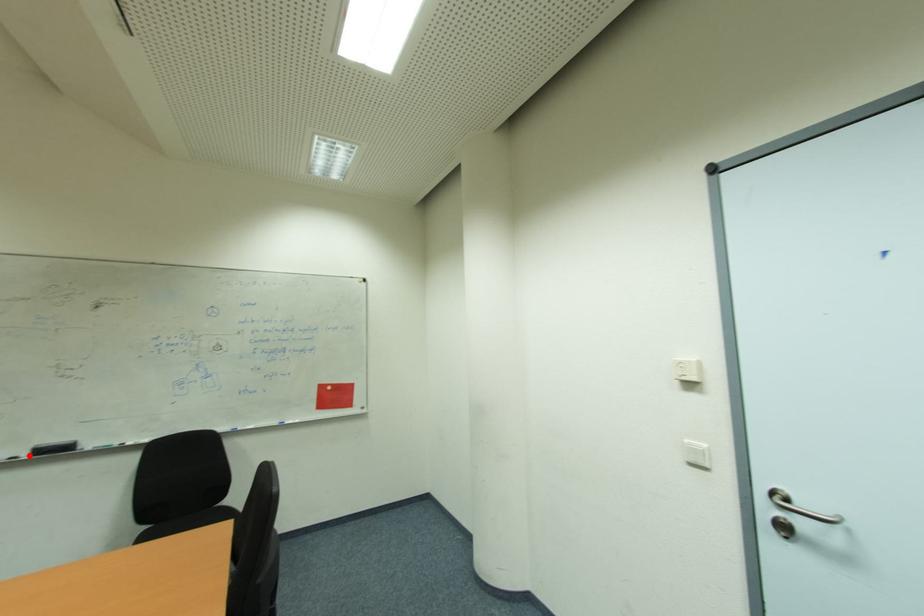
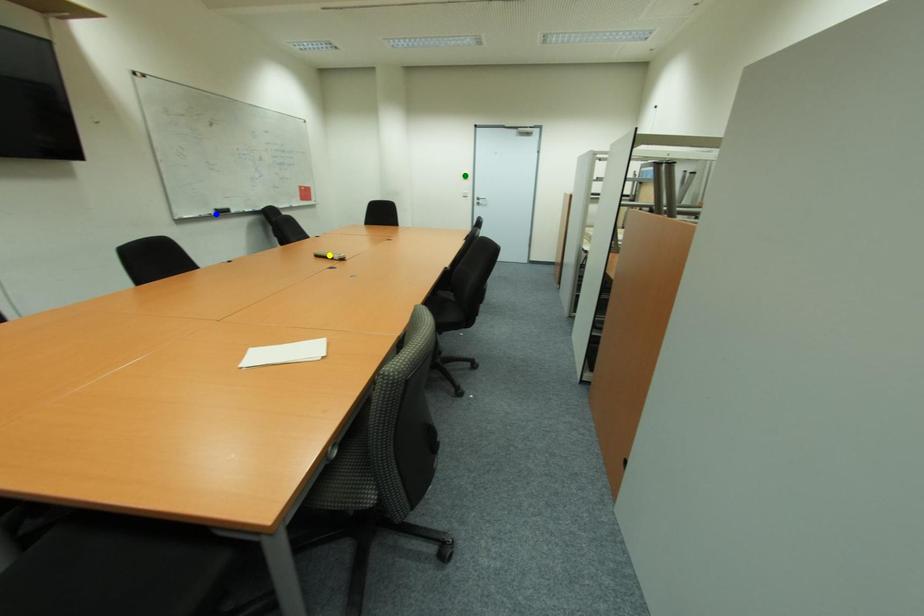
Question: I am providing you with two images of the same scene from different viewpoints. A red point is marked on the first image. You are given multiple points on the second image. Which point in image 2 is actually the same real-world point as the red point in image 1?

Choices:
 (A) blue point
 (B) green point
 (C) yellow point

Answer: (A)